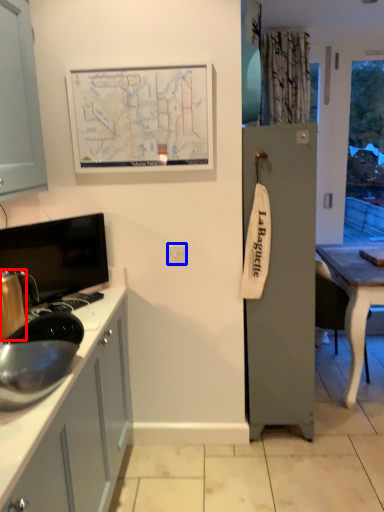
Question: Among these objects, which one is farthest to the camera, appliance (highlighted by a red box) or electric outlet (highlighted by a blue box)?

Choices:
 (A) appliance
 (B) electric outlet

Answer: (B)